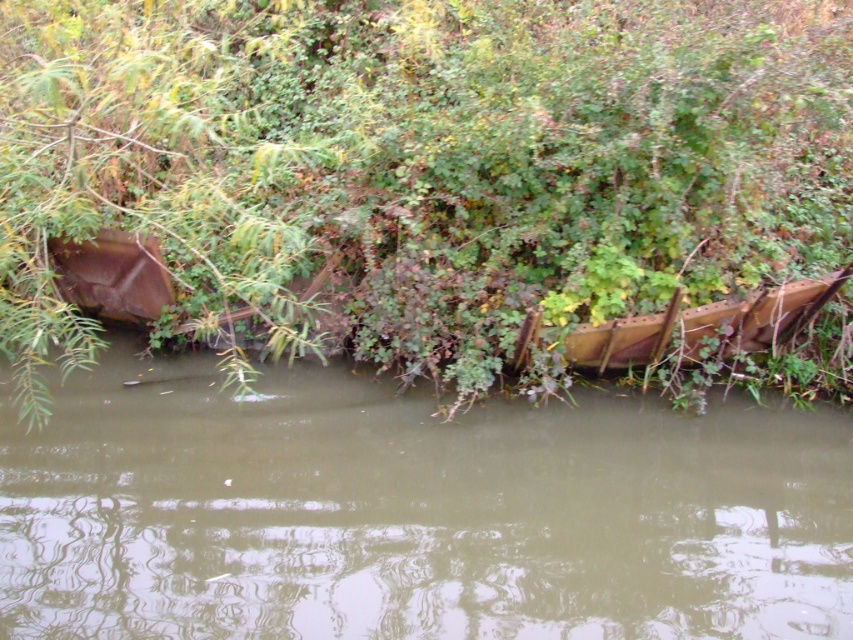
You are a wildlife photographer trying to capture an image of a rare bird that nests on the larger boat. Which boat should you focus on, the brown wooden boat at center or the rusty metal boat at center?

The rusty metal boat at center is larger than the brown wooden boat at center, so you should focus on the rusty metal boat at center to capture the rare bird.

You are a photographer trying to capture the brown wooden boat at center in your shot. However, the green matte tree at upper left is blocking part of the boat. Can you adjust your position to avoid the tree?

The green matte tree at upper left is taller than the brown wooden boat at center. By moving your position to the right or left, you can angle your camera to avoid the tree blocking the boat.

Based on the photo, you are standing on the bank of the waterway and want to cross to the other side. You see a brown wooden boat at center and a rusty metal boat at center. Which boat is closer to your right side?

The brown wooden boat at center is to the right of the rusty metal boat at center, so if you are facing the waterway, the brown wooden boat at center would be closer to your right side.